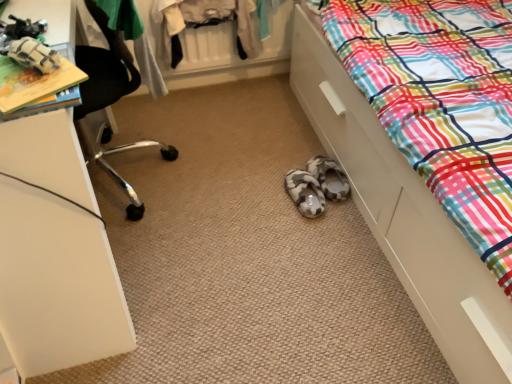
The width and height of the screenshot is (512, 384). What do you see at coordinates (109, 100) in the screenshot? I see `black mesh chair at upper left` at bounding box center [109, 100].

Locate an element on the screen. black mesh chair at upper left is located at coordinates (109, 100).

What do you see at coordinates (405, 217) in the screenshot? This screenshot has width=512, height=384. I see `multicolored plaid fabric at lower right` at bounding box center [405, 217].

I want to click on multicolored plaid fabric at lower right, so click(x=405, y=217).

I want to click on black mesh chair at upper left, so click(109, 100).

Considering the relative positions of black mesh chair at upper left and multicolored plaid fabric at lower right in the image provided, is black mesh chair at upper left to the left or to the right of multicolored plaid fabric at lower right?

In the image, black mesh chair at upper left appears on the left side of multicolored plaid fabric at lower right.

Between black mesh chair at upper left and multicolored plaid fabric at lower right, which one is positioned in front?

multicolored plaid fabric at lower right.

Which is closer to the camera, (165, 147) or (296, 73)?

The point (165, 147) is closer to the camera.

From the image's perspective, is black mesh chair at upper left beneath multicolored plaid fabric at lower right?

Incorrect, from the image's perspective, black mesh chair at upper left is higher than multicolored plaid fabric at lower right.

From a real-world perspective, is black mesh chair at upper left positioned over multicolored plaid fabric at lower right based on gravity?

Correct, in the physical world, black mesh chair at upper left is higher than multicolored plaid fabric at lower right.

Does black mesh chair at upper left have a lesser width compared to multicolored plaid fabric at lower right?

Correct, the width of black mesh chair at upper left is less than that of multicolored plaid fabric at lower right.

Considering the relative sizes of black mesh chair at upper left and multicolored plaid fabric at lower right in the image provided, is black mesh chair at upper left shorter than multicolored plaid fabric at lower right?

Yes.

Is black mesh chair at upper left bigger or smaller than multicolored plaid fabric at lower right?

black mesh chair at upper left is smaller than multicolored plaid fabric at lower right.

Is black mesh chair at upper left inside or outside of multicolored plaid fabric at lower right?

black mesh chair at upper left is located beyond the bounds of multicolored plaid fabric at lower right.

Is black mesh chair at upper left touching multicolored plaid fabric at lower right?

No, black mesh chair at upper left is not making contact with multicolored plaid fabric at lower right.

Could you tell me if black mesh chair at upper left is facing multicolored plaid fabric at lower right?

Yes.

What's the angular difference between black mesh chair at upper left and multicolored plaid fabric at lower right's facing directions?

There is a 161-degree angle between the facing directions of black mesh chair at upper left and multicolored plaid fabric at lower right.

How distant is black mesh chair at upper left from multicolored plaid fabric at lower right?

black mesh chair at upper left and multicolored plaid fabric at lower right are 33.73 inches apart.

Locate an element on the screen. bed below the black mesh chair at upper left (from a real-world perspective) is located at coordinates click(x=405, y=217).

Is multicolored plaid fabric at lower right at the right side of black mesh chair at upper left?

Correct, you'll find multicolored plaid fabric at lower right to the right of black mesh chair at upper left.

Looking at this image, considering their positions, is multicolored plaid fabric at lower right located in front of or behind black mesh chair at upper left?

In the image, multicolored plaid fabric at lower right appears in front of black mesh chair at upper left.

Which is closer, (434, 335) or (116, 55)?

Point (434, 335) appears to be closer to the viewer than point (116, 55).

From the image's perspective, is multicolored plaid fabric at lower right beneath black mesh chair at upper left?

Yes, from the image's perspective, multicolored plaid fabric at lower right is beneath black mesh chair at upper left.

From a real-world perspective, is multicolored plaid fabric at lower right positioned under black mesh chair at upper left based on gravity?

Yes, from a real-world perspective, multicolored plaid fabric at lower right is under black mesh chair at upper left.

Which of these two, multicolored plaid fabric at lower right or black mesh chair at upper left, is wider?

multicolored plaid fabric at lower right.

Considering the sizes of objects multicolored plaid fabric at lower right and black mesh chair at upper left in the image provided, who is taller, multicolored plaid fabric at lower right or black mesh chair at upper left?

multicolored plaid fabric at lower right is taller.

Considering the relative sizes of multicolored plaid fabric at lower right and black mesh chair at upper left in the image provided, is multicolored plaid fabric at lower right bigger than black mesh chair at upper left?

Yes.

Would you say multicolored plaid fabric at lower right is outside black mesh chair at upper left?

Yes, multicolored plaid fabric at lower right is not within black mesh chair at upper left.

Is multicolored plaid fabric at lower right far from black mesh chair at upper left?

No, multicolored plaid fabric at lower right is not far from black mesh chair at upper left.

Based on the photo, is black mesh chair at upper left at the back of multicolored plaid fabric at lower right?

multicolored plaid fabric at lower right is not turned away from black mesh chair at upper left.

Can you tell me how much multicolored plaid fabric at lower right and black mesh chair at upper left differ in facing direction?

161 degrees separate the facing orientations of multicolored plaid fabric at lower right and black mesh chair at upper left.

Identify the location of chair on the left of multicolored plaid fabric at lower right. Image resolution: width=512 pixels, height=384 pixels. (109, 100).

The width and height of the screenshot is (512, 384). In order to click on chair above the multicolored plaid fabric at lower right (from a real-world perspective) in this screenshot , I will do `click(109, 100)`.

The width and height of the screenshot is (512, 384). What are the coordinates of `bed located in front of the black mesh chair at upper left` in the screenshot? It's located at (405, 217).